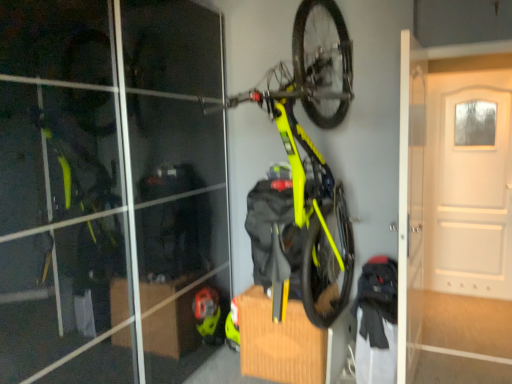
Question: From a real-world perspective, is white matte door at upper right positioned above or below neon yellow matte bicycle at upper center?

Choices:
 (A) below
 (B) above

Answer: (A)

Question: From the image's perspective, relative to neon yellow matte bicycle at upper center, is white matte door at upper right above or below?

Choices:
 (A) below
 (B) above

Answer: (A)

Question: Is white matte door at upper right taller or shorter than neon yellow matte bicycle at upper center?

Choices:
 (A) tall
 (B) short

Answer: (A)

Question: In terms of size, does neon yellow matte bicycle at upper center appear bigger or smaller than white matte door at upper right?

Choices:
 (A) big
 (B) small

Answer: (A)

Question: From a real-world perspective, relative to white matte door at upper right, is neon yellow matte bicycle at upper center vertically above or below?

Choices:
 (A) below
 (B) above

Answer: (B)

Question: From the image's perspective, is neon yellow matte bicycle at upper center positioned above or below white matte door at upper right?

Choices:
 (A) above
 (B) below

Answer: (A)

Question: Considering the positions of neon yellow matte bicycle at upper center and white matte door at upper right in the image, is neon yellow matte bicycle at upper center wider or thinner than white matte door at upper right?

Choices:
 (A) wide
 (B) thin

Answer: (A)